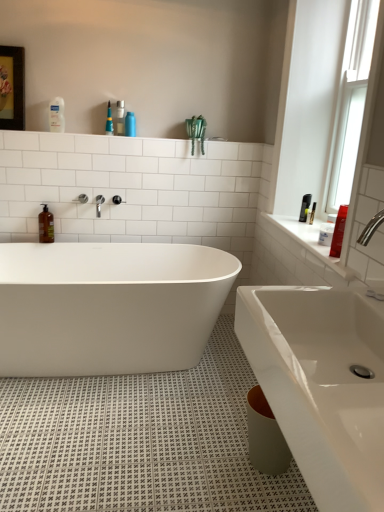
Question: In the image, is white glossy sink at lower right positioned in front of or behind clear glass window at upper right?

Choices:
 (A) behind
 (B) front

Answer: (B)

Question: From a real-world perspective, is white glossy sink at lower right physically located above or below clear glass window at upper right?

Choices:
 (A) below
 (B) above

Answer: (A)

Question: Which is farther from the white glossy bathtub at center?

Choices:
 (A) white glossy sink at lower right
 (B) brown glass soap dispenser at left
 (C) white glossy lotion at upper left, the first toiletry from the left
 (D) clear glass window at upper right
 (E) wooden framed artwork at upper left

Answer: (D)

Question: Based on their relative distances, which object is farther from the wooden framed artwork at upper left?

Choices:
 (A) clear glass window at upper right
 (B) silver metallic faucet at upper center
 (C) brown glass soap dispenser at left
 (D) matte black bottle at right, which is the first toiletry from right to left
 (E) white glossy lotion at upper left, the first toiletry viewed from the back

Answer: (D)